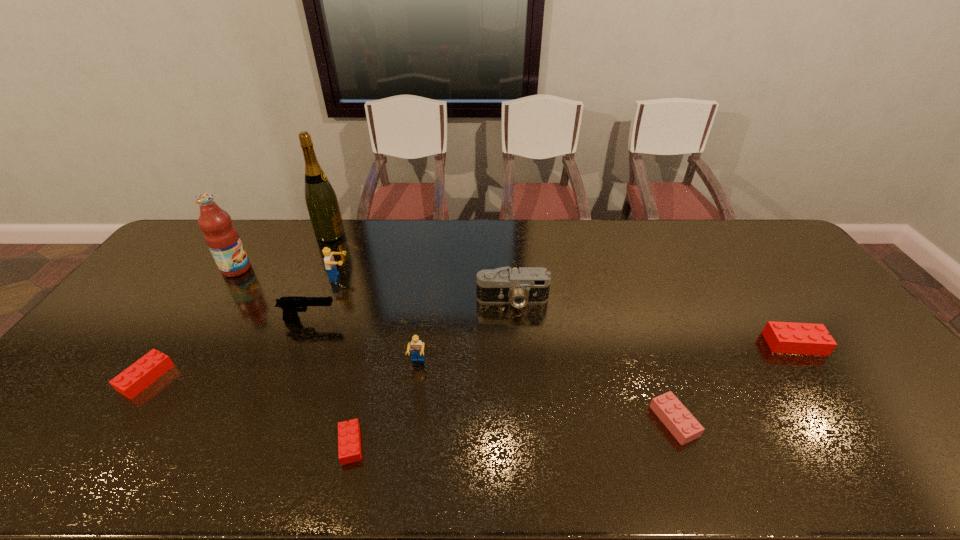
Where is `the third Lego from right to left`? the third Lego from right to left is located at coordinates (416, 346).

The height and width of the screenshot is (540, 960). I want to click on the rightmost object, so click(782, 337).

You are a GUI agent. You are given a task and a screenshot of the screen. Output one action in this format:
    pyautogui.click(x=<x>, y=<y>)
    Task: Click on the rightmost red Lego
    This screenshot has width=960, height=540.
    Given the screenshot: What is the action you would take?
    pyautogui.click(x=782, y=337)

Find the location of a particular element. Image resolution: width=960 pixels, height=540 pixels. the second smallest red Lego is located at coordinates (137, 377).

Where is `the second nearest red Lego`? The height and width of the screenshot is (540, 960). the second nearest red Lego is located at coordinates (137, 377).

The image size is (960, 540). What are the coordinates of `the ninth object from left to right` in the screenshot? It's located at (674, 415).

Identify the location of the second Lego from right to left. The width and height of the screenshot is (960, 540). (674, 415).

This screenshot has width=960, height=540. In order to click on the third Lego from left to right in this screenshot , I will do `click(349, 443)`.

The width and height of the screenshot is (960, 540). I want to click on the fifth object from right to left, so click(x=349, y=443).

Where is `free space located 0.080m on the front-facing side of the tallest object`? free space located 0.080m on the front-facing side of the tallest object is located at coordinates (366, 234).